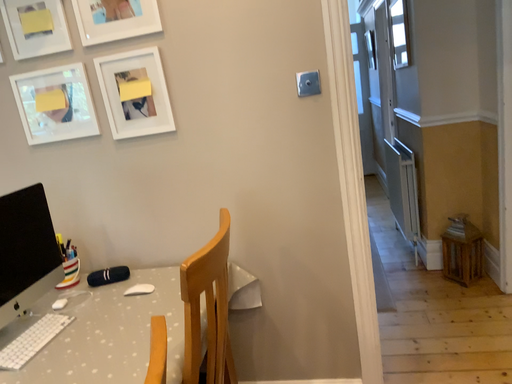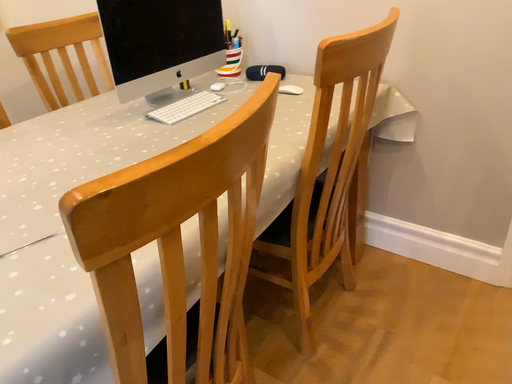
Question: How did the camera likely rotate when shooting the video?

Choices:
 (A) rotated downward
 (B) rotated upward

Answer: (A)